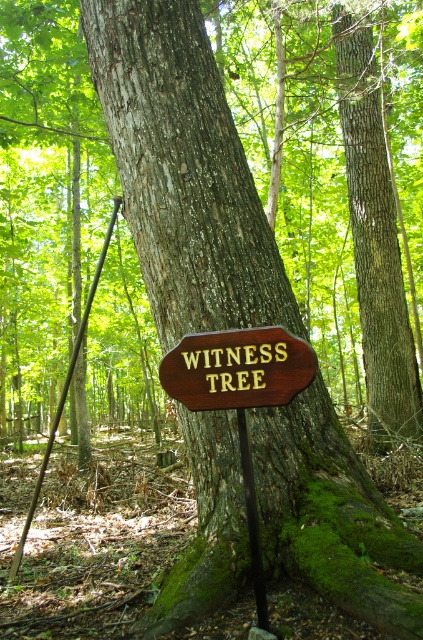
Where is `brown rough bark tree trunk at center`? This screenshot has width=423, height=640. brown rough bark tree trunk at center is located at coordinates (375, 237).

Does brown rough bark tree trunk at center appear under black metal pole at center?

No, brown rough bark tree trunk at center is not below black metal pole at center.

Does point (354, 216) come closer to viewer compared to point (244, 467)?

No, (354, 216) is behind (244, 467).

The image size is (423, 640). I want to click on brown rough bark tree trunk at center, so click(x=375, y=237).

Does point (338, 108) come closer to viewer compared to point (44, 470)?

No, it is behind (44, 470).

Locate an element on the screen. The image size is (423, 640). brown rough bark tree trunk at center is located at coordinates (375, 237).

Identify the location of brown rough bark tree trunk at center. (375, 237).

Is point (280, 337) farther from camera compared to point (43, 468)?

No.

Can you confirm if wooden sign at center is taller than brushed metal pole at left?

In fact, wooden sign at center may be shorter than brushed metal pole at left.

Which is behind, point (216, 397) or point (49, 449)?

Positioned behind is point (49, 449).

Locate an element on the screen. wooden sign at center is located at coordinates tap(238, 369).